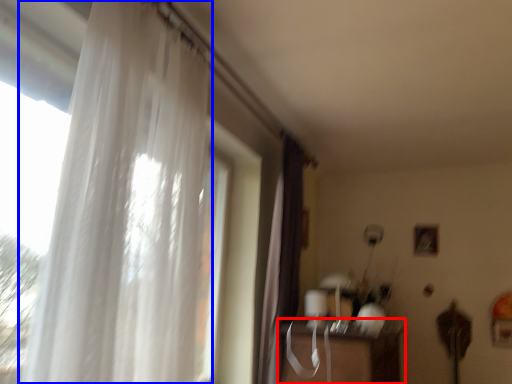
Question: Among these objects, which one is farthest to the camera, table (highlighted by a red box) or curtain (highlighted by a blue box)?

Choices:
 (A) table
 (B) curtain

Answer: (A)